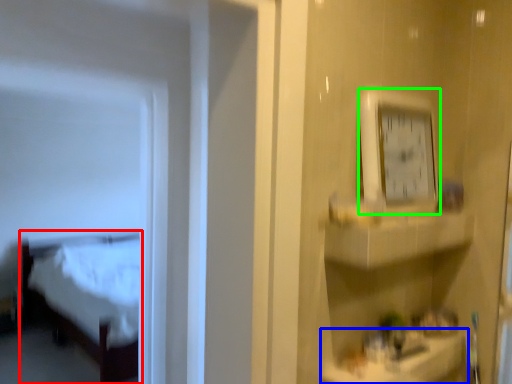
Question: Which object is positioned closest to furniture (highlighted by a red box)? Select from counter top (highlighted by a blue box) and clock (highlighted by a green box).

Choices:
 (A) counter top
 (B) clock

Answer: (A)